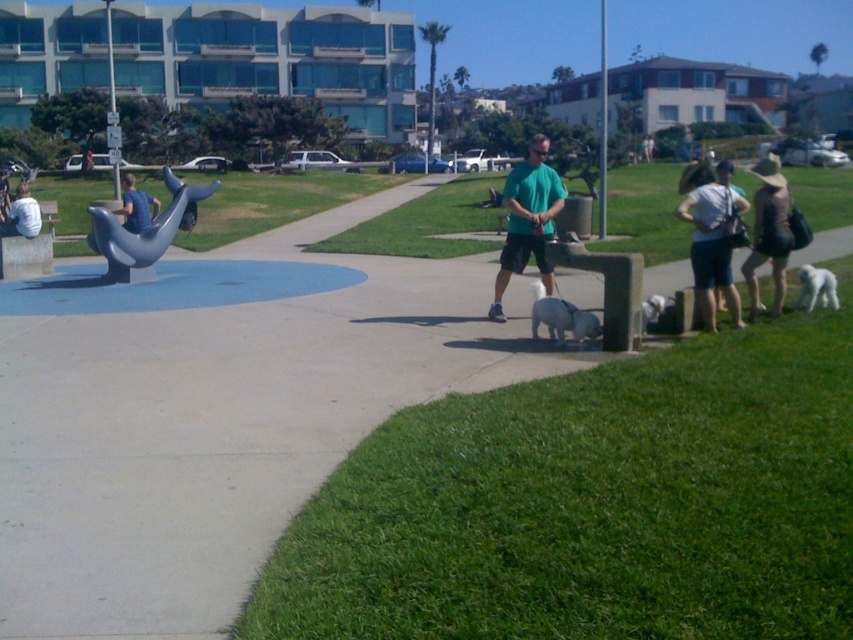
Question: Does white fluffy dog at center come behind blue fabric shirt at left?

Choices:
 (A) yes
 (B) no

Answer: (B)

Question: Is white fluffy dog at center further to the viewer compared to white shirt at left?

Choices:
 (A) no
 (B) yes

Answer: (A)

Question: Which point is farther from the camera taking this photo?

Choices:
 (A) (126, 221)
 (B) (482, 371)
 (C) (6, 214)

Answer: (C)

Question: Among these objects, which one is farthest from the camera?

Choices:
 (A) camouflage fabric hat at right
 (B) shiny metallic dolphin at left
 (C) white shirt at left

Answer: (C)

Question: Which object is closer to the camera taking this photo?

Choices:
 (A) teal t-shirt at center
 (B) white fur dog at lower right
 (C) blue rubber pavement at center
 (D) shiny metallic dolphin at left

Answer: (C)

Question: Does white fluffy dog at center have a smaller size compared to white fur dog at lower right?

Choices:
 (A) no
 (B) yes

Answer: (A)